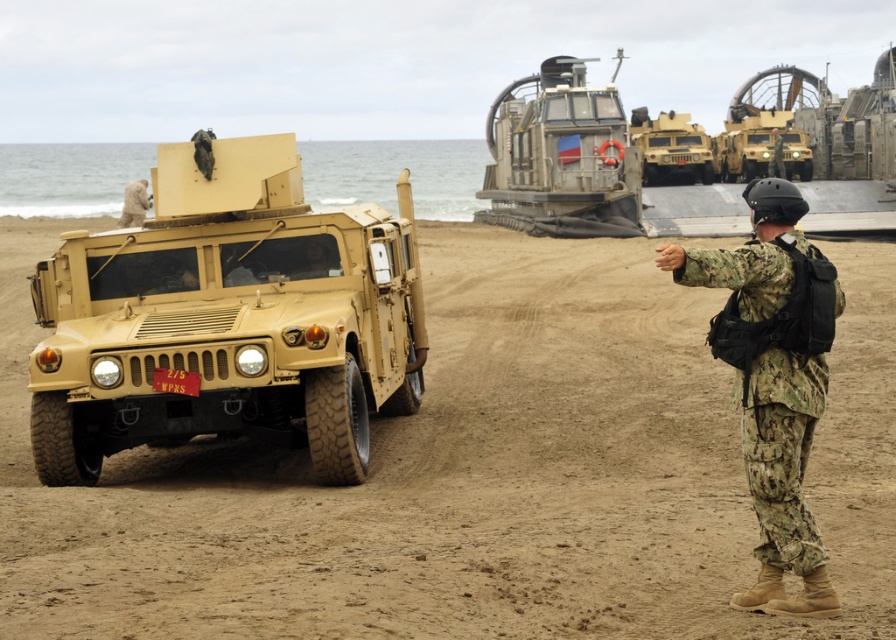
Question: Can you confirm if white fur dog at left is positioned to the right of camouflage uniform at center?

Choices:
 (A) no
 (B) yes

Answer: (A)

Question: Does tan matte vehicle at left come in front of matte tan vehicle at left?

Choices:
 (A) yes
 (B) no

Answer: (A)

Question: Which point is farther to the camera?

Choices:
 (A) (416, 305)
 (B) (774, 161)

Answer: (B)

Question: Which of the following is the farthest from the observer?

Choices:
 (A) camouflage fabric uniform at center
 (B) matte tan vehicle at left
 (C) camouflage uniform at center
 (D) white fur dog at left

Answer: (C)

Question: Does metallic gray tank at center appear under white fur dog at left?

Choices:
 (A) yes
 (B) no

Answer: (B)

Question: Which of the following is the farthest from the observer?

Choices:
 (A) (702, 445)
 (B) (601, 221)
 (C) (128, 196)

Answer: (B)